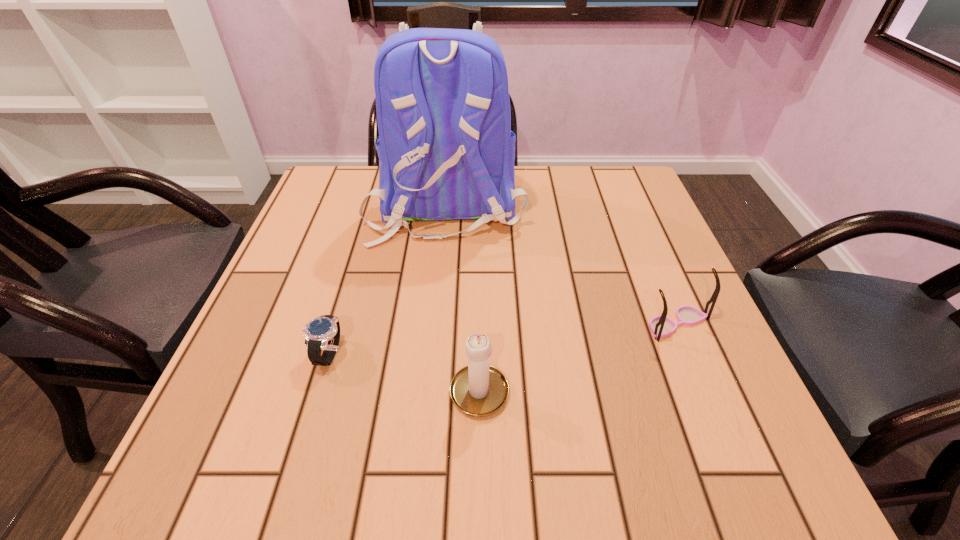
Identify the location of vacant point located between the shortest object and the candle holder. (404, 370).

At what (x,y) coordinates should I click in order to perform the action: click on vacant area that lies between the third shortest object and the shortest object. Please return your answer as a coordinate pair (x, y). The height and width of the screenshot is (540, 960). Looking at the image, I should click on (404, 370).

Where is `vacant space that is in between the backpack and the candle holder`? This screenshot has width=960, height=540. vacant space that is in between the backpack and the candle holder is located at coordinates (463, 296).

The width and height of the screenshot is (960, 540). Find the location of `the closest object to the third tallest object`. the closest object to the third tallest object is located at coordinates (446, 151).

This screenshot has height=540, width=960. I want to click on object that is the closest to the shortest object, so click(x=479, y=390).

Where is `vacant area in the image that satisfies the following two spatial constraints: 1. on the handle side of the candle holder; 2. on the right side of the spectacles`? Image resolution: width=960 pixels, height=540 pixels. vacant area in the image that satisfies the following two spatial constraints: 1. on the handle side of the candle holder; 2. on the right side of the spectacles is located at coordinates (479, 323).

You are a GUI agent. You are given a task and a screenshot of the screen. Output one action in this format:
    pyautogui.click(x=<x>, y=<y>)
    Task: Click on the vacant space that satisfies the following two spatial constraints: 1. on the back of the spectacles; 2. on the right side of the tallest object
    The image size is (960, 540).
    Given the screenshot: What is the action you would take?
    pyautogui.click(x=435, y=323)

Find the location of a particular element. This screenshot has width=960, height=540. free location that satisfies the following two spatial constraints: 1. on the handle side of the second shortest object; 2. on the right side of the third shortest object is located at coordinates (479, 323).

Find the location of a particular element. This screenshot has width=960, height=540. free location that satisfies the following two spatial constraints: 1. on the handle side of the rightmost object; 2. on the left side of the third shortest object is located at coordinates (479, 323).

Identify the location of free spot that satisfies the following two spatial constraints: 1. on the back side of the watch; 2. on the right side of the spectacles. Image resolution: width=960 pixels, height=540 pixels. (337, 323).